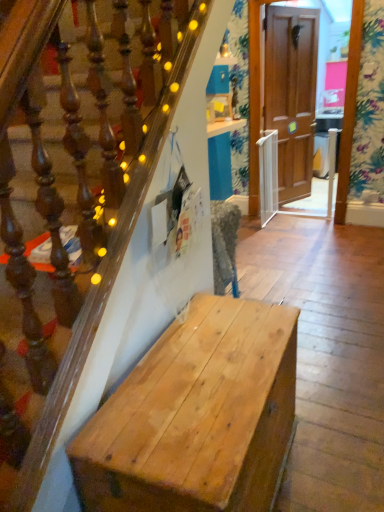
The image size is (384, 512). Describe the element at coordinates (197, 416) in the screenshot. I see `natural wood bench at lower left` at that location.

In order to face natural wood bench at lower left, should I rotate leftwards or rightwards?

Rotate right and turn 2.816 degrees.

What is the approximate height of natural wood bench at lower left?

It is 24.34 inches.

Find the location of `natural wood bench at lower left`. natural wood bench at lower left is located at coordinates (197, 416).

Image resolution: width=384 pixels, height=512 pixels. In order to click on wooden door at center in this screenshot , I will do `click(291, 93)`.

This screenshot has width=384, height=512. What do you see at coordinates (291, 93) in the screenshot?
I see `wooden door at center` at bounding box center [291, 93].

Locate an element on the screen. The width and height of the screenshot is (384, 512). natural wood bench at lower left is located at coordinates (197, 416).

Between wooden door at center and natural wood bench at lower left, which one appears on the left side from the viewer's perspective?

natural wood bench at lower left is more to the left.

Which object is more forward, wooden door at center or natural wood bench at lower left?

natural wood bench at lower left is closer to the camera.

Which is closer, (291,59) or (171,433)?

Positioned in front is point (171,433).

Looking at this image, from the image's perspective, is wooden door at center under natural wood bench at lower left?

Actually, wooden door at center appears above natural wood bench at lower left in the image.

From a real-world perspective, who is located higher, wooden door at center or natural wood bench at lower left?

In real-world perspective, wooden door at center is above.

Which object is thinner, wooden door at center or natural wood bench at lower left?

Thinner between the two is wooden door at center.

From the picture: Who is shorter, wooden door at center or natural wood bench at lower left?

natural wood bench at lower left.

Between wooden door at center and natural wood bench at lower left, which one has larger size?

With larger size is natural wood bench at lower left.

Do you think wooden door at center is within natural wood bench at lower left, or outside of it?

wooden door at center is not enclosed by natural wood bench at lower left.

Can you see wooden door at center touching natural wood bench at lower left?

No, wooden door at center is not with natural wood bench at lower left.

Is natural wood bench at lower left at the back of wooden door at center?

wooden door at center is not turned away from natural wood bench at lower left.

Locate an element on the screen. desk located below the wooden door at center (from the image's perspective) is located at coordinates (197, 416).

In the image, is natural wood bench at lower left on the left side or the right side of wooden door at center?

From the image, it's evident that natural wood bench at lower left is to the left of wooden door at center.

Is natural wood bench at lower left in front of or behind wooden door at center in the image?

In the image, natural wood bench at lower left appears in front of wooden door at center.

Which point is more forward, (x=105, y=474) or (x=282, y=23)?

The point (x=105, y=474) is closer.

From the image's perspective, which one is positioned higher, natural wood bench at lower left or wooden door at center?

From the image's view, wooden door at center is above.

From a real-world perspective, between natural wood bench at lower left and wooden door at center, who is vertically lower?

From a 3D spatial view, natural wood bench at lower left is below.

Is natural wood bench at lower left wider than wooden door at center?

Yes, natural wood bench at lower left is wider than wooden door at center.

Looking at this image, who is shorter, natural wood bench at lower left or wooden door at center?

natural wood bench at lower left is shorter.

Considering the sizes of objects natural wood bench at lower left and wooden door at center in the image provided, who is bigger, natural wood bench at lower left or wooden door at center?

natural wood bench at lower left.

Is natural wood bench at lower left situated inside wooden door at center or outside?

The correct answer is: outside.

Does natural wood bench at lower left touch wooden door at center?

natural wood bench at lower left and wooden door at center are not in contact.

Is natural wood bench at lower left turned away from wooden door at center?

No, natural wood bench at lower left is not facing away from wooden door at center.

Where is `door located above the natural wood bench at lower left (from a real-world perspective)`? Image resolution: width=384 pixels, height=512 pixels. door located above the natural wood bench at lower left (from a real-world perspective) is located at coordinates (291, 93).

Identify the location of desk in front of the wooden door at center. coord(197,416).

Locate an element on the screen. The image size is (384, 512). door that is above the natural wood bench at lower left (from the image's perspective) is located at coordinates point(291,93).